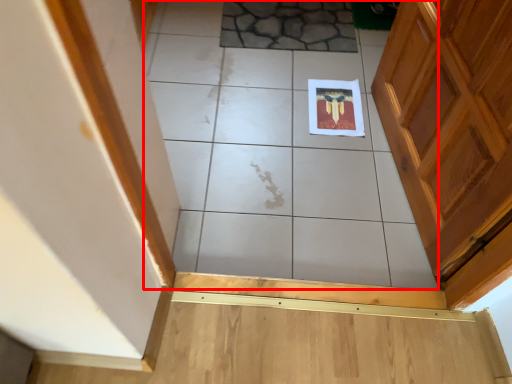
Question: From the image, what is the correct spatial relationship of ceramic tile (annotated by the red box) in relation to ceramic tile?

Choices:
 (A) right
 (B) left

Answer: (A)